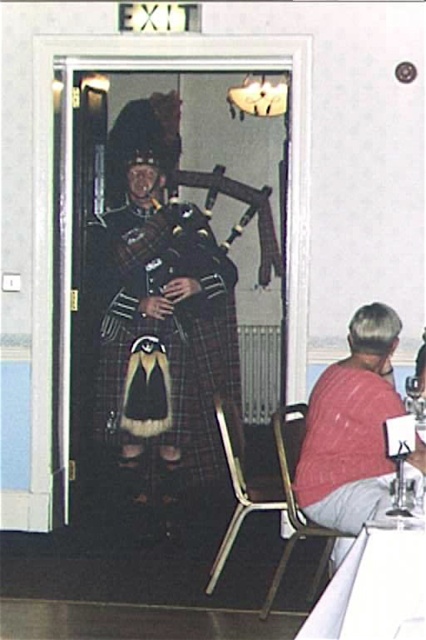
Question: Based on their relative distances, which object is nearer to the polished wood bagpipes at center?

Choices:
 (A) metallic gold chair at lower center
 (B) red knit sweater at lower right
 (C) plaid fabric kilt at center

Answer: (C)

Question: In this image, where is plaid fabric kilt at center located relative to metallic gold chair at lower right?

Choices:
 (A) right
 (B) left

Answer: (B)

Question: Is plaid fabric kilt at center bigger than metallic gold chair at lower center?

Choices:
 (A) no
 (B) yes

Answer: (B)

Question: Can you confirm if metallic gold chair at lower center is positioned below metallic gold chair at lower right?

Choices:
 (A) yes
 (B) no

Answer: (B)

Question: Among these objects, which one is nearest to the camera?

Choices:
 (A) metallic gold chair at lower center
 (B) metallic gold chair at lower right
 (C) red knit sweater at lower right

Answer: (C)

Question: Based on their relative distances, which object is nearer to the plaid fabric kilt at center?

Choices:
 (A) polished wood bagpipes at center
 (B) red knit sweater at lower right

Answer: (A)